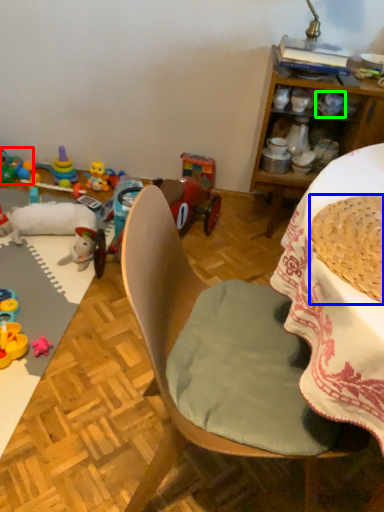
Question: Based on their relative distances, which object is nearer to toy (highlighted by a red box)? Choose from basket (highlighted by a blue box) and coffee cup (highlighted by a green box).

Choices:
 (A) basket
 (B) coffee cup

Answer: (B)